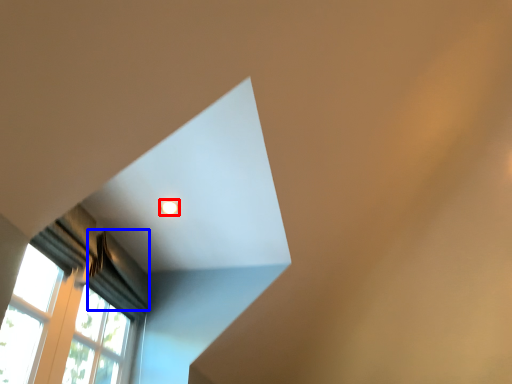
Question: Which point is closer to the camera, lighting (highlighted by a red box) or curtain (highlighted by a blue box)?

Choices:
 (A) lighting
 (B) curtain

Answer: (B)